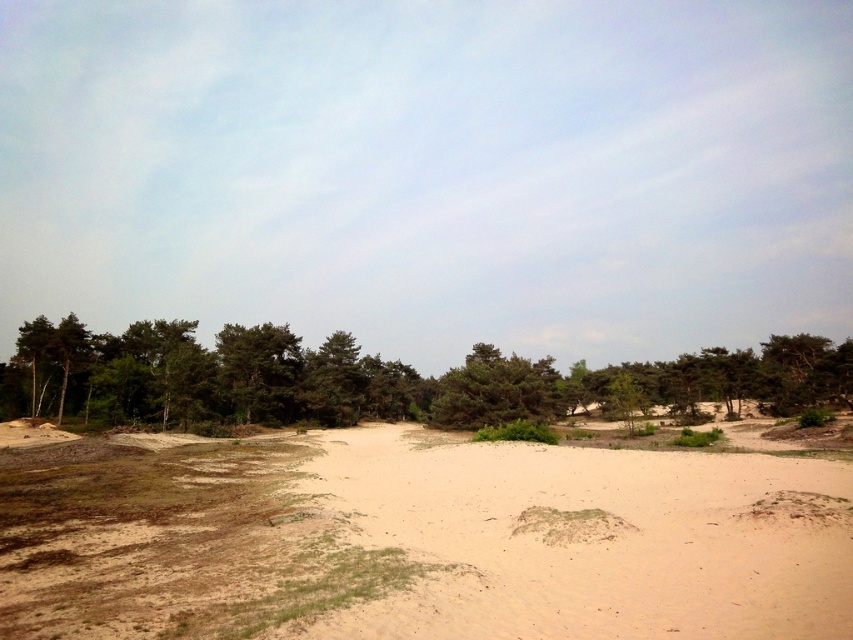
You are standing on the light brown sandy ground at center and want to reach the green leafy trees at left. Which direction should you walk to get there?

To reach the green leafy trees at left from the light brown sandy ground at center, you should walk to the left since the light brown sandy ground at center is positioned on the left side of the green leafy trees at left.

You are standing at the origin point in the image and want to reach the light brown sandy ground at center. What are the coordinates you need to move to?

You need to move to the coordinates point at [419,540] to reach the light brown sandy ground at center.

You are standing at the center of the sandy terrain and see two points marked in the image. The first point is at coordinates point (80, 557) and the second is at point (715, 352). Which point is closer to you?

Point (80, 557) is in front of point (715, 352), so the first point is closer to you.